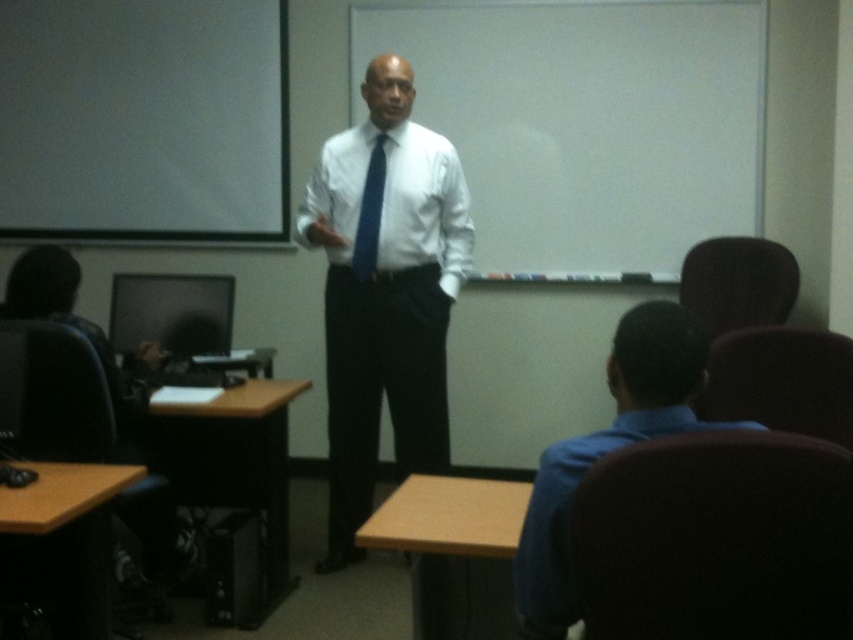
You are a student sitting at the desk and want to look at both the matte black monitor at left and the blue silk tie at center. Which object should you turn your head to the right to see?

You should turn your head to the right to see the blue silk tie at center because it is located to the right of the matte black monitor at left.

You are a student sitting at the desk in the classroom. You want to see the presenter clearly. Which object is closer to you between the white glossy shirt at center and the blue silk tie at center?

The white glossy shirt at center is closer to you because it is in front of the blue silk tie at center.

You are a student sitting at the desk in the classroom. You need to reach both the matte black monitor at left and the blue silk tie at center. Which object is closer to you?

The blue silk tie at center is closer to you because it is only 3.38 feet away from the matte black monitor at left, and since you are sitting at the desk, the tie would be in front of the presenter who is closer to the front of the room compared to the monitor which is on the left side further away.